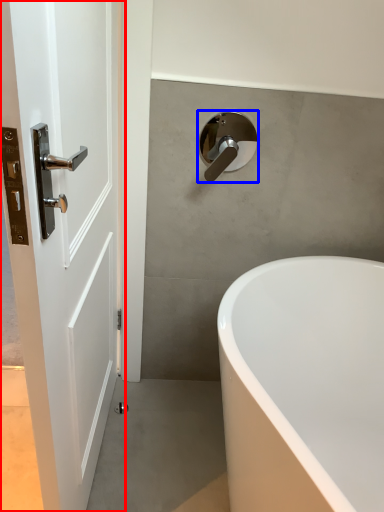
Question: Which point is closer to the camera, door (highlighted by a red box) or tap (highlighted by a blue box)?

Choices:
 (A) door
 (B) tap

Answer: (A)